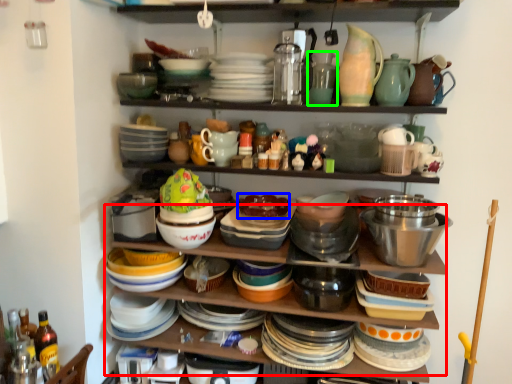
Question: Estimate the real-world distances between objects in this image. Which object is farther from shelf (highlighted by a red box), food (highlighted by a blue box) or tableware (highlighted by a green box)?

Choices:
 (A) food
 (B) tableware

Answer: (B)